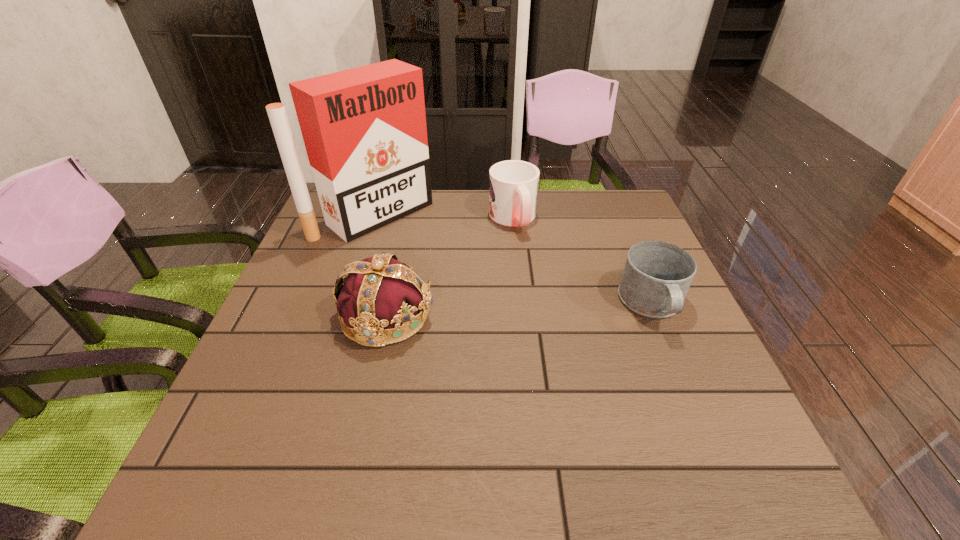
Locate an element on the screen. The height and width of the screenshot is (540, 960). vacant space on the desktop that is between the crown and the nearer mug and is positioned on the side of the farther mug with the handle is located at coordinates (558, 309).

This screenshot has width=960, height=540. What are the coordinates of `vacant space on the desktop that is between the crown and the rightmost object and is positioned on the front-facing side of the tallest object` in the screenshot? It's located at (506, 311).